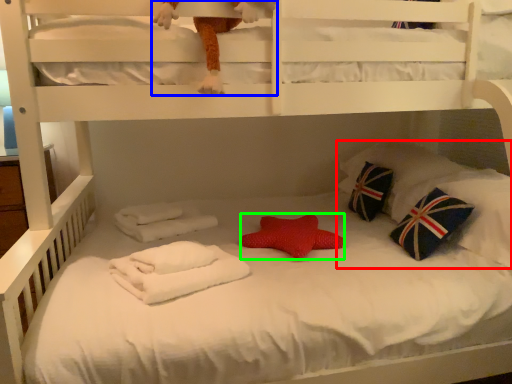
Question: Which object is positioned closest to pillow (highlighted by a red box)? Select from toy (highlighted by a blue box) and throw pillow (highlighted by a green box).

Choices:
 (A) toy
 (B) throw pillow

Answer: (B)